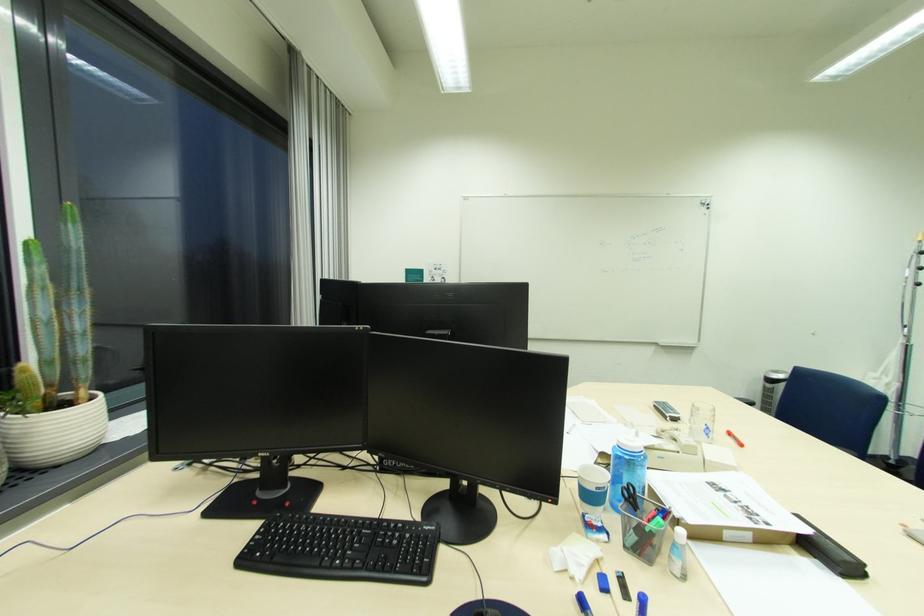
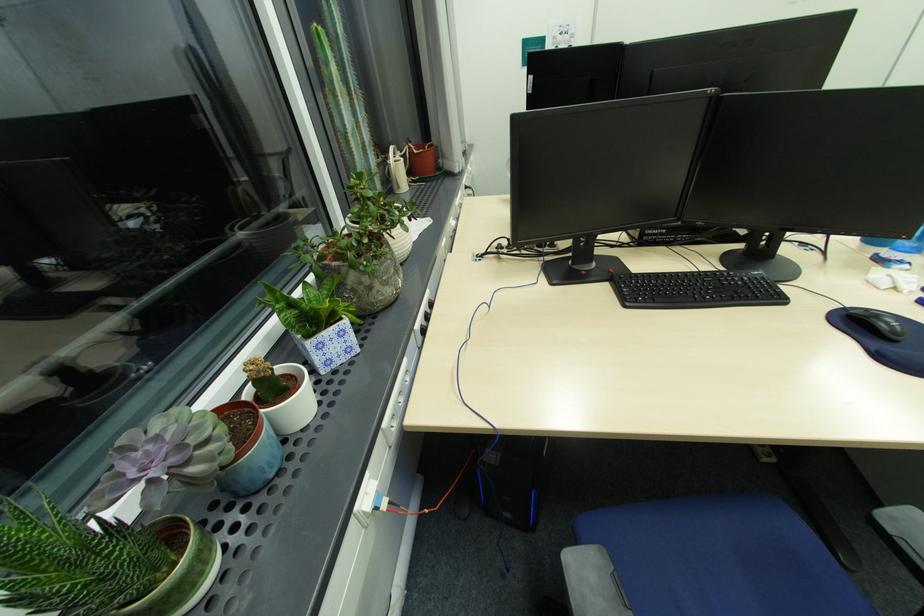
Question: How did the camera likely rotate?

Choices:
 (A) Left
 (B) Right
 (C) Up
 (D) Down

Answer: (D)